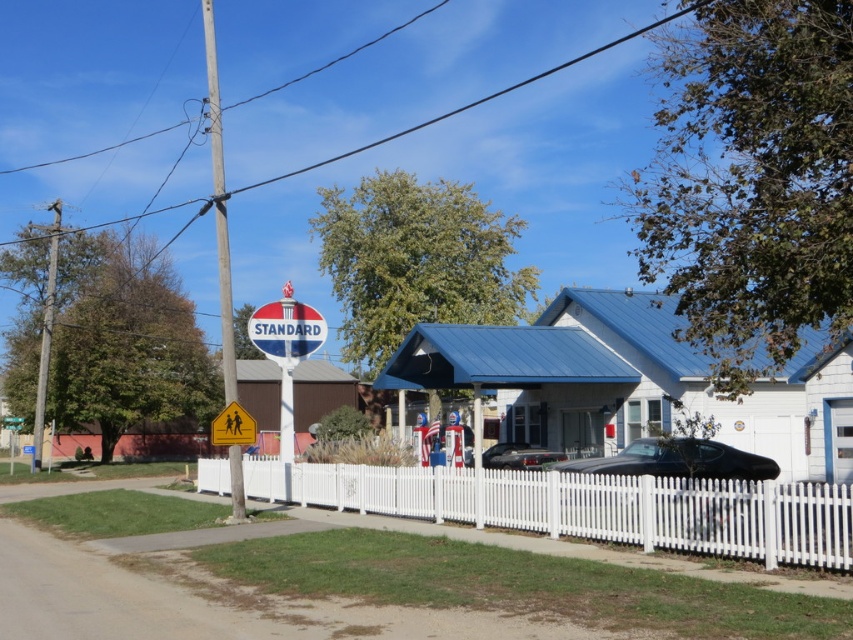
Question: Can you confirm if wooden utility pole at center is smaller than yellow plastic pedestrian crossing sign at center?

Choices:
 (A) yes
 (B) no

Answer: (B)

Question: Which object is the farthest from the yellow plastic pedestrian crossing sign at center?

Choices:
 (A) shiny black car at center
 (B) white picket fence at center
 (C) wooden utility pole at center
 (D) black matte car at center

Answer: (C)

Question: Which of the following is the closest to the observer?

Choices:
 (A) (532, 451)
 (B) (18, 428)
 (C) (224, 432)
 (D) (44, 346)

Answer: (C)

Question: Considering the relative positions of wooden utility pole at center and smooth wooden utility pole at left in the image provided, where is wooden utility pole at center located with respect to smooth wooden utility pole at left?

Choices:
 (A) below
 (B) above

Answer: (B)

Question: Does white picket fence at center appear over green plastic street sign at upper center?

Choices:
 (A) no
 (B) yes

Answer: (B)

Question: Which object is the closest to the green plastic street sign at upper center?

Choices:
 (A) wooden utility pole at center
 (B) yellow plastic pedestrian crossing sign at center
 (C) white picket fence at center
 (D) smooth wooden utility pole at left

Answer: (D)